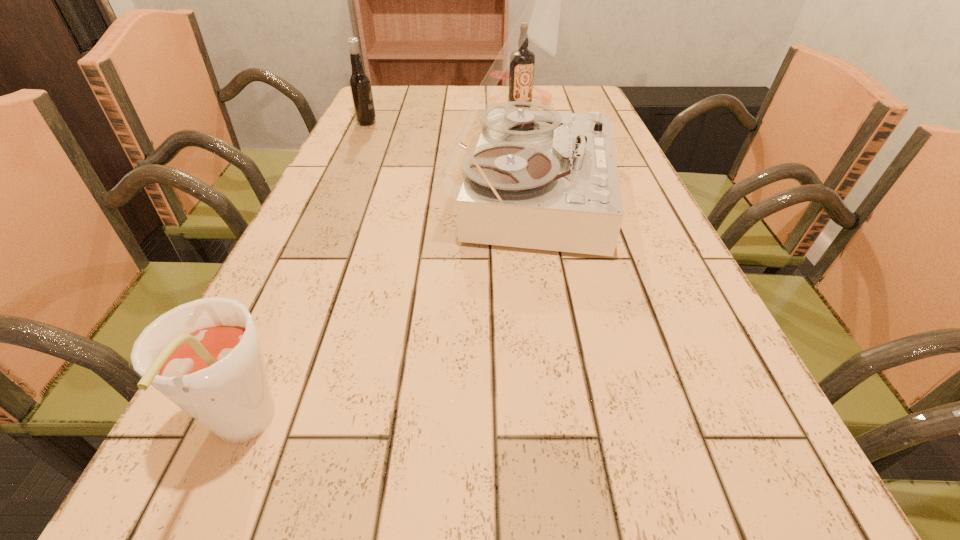
Where is `object that stands as the second closest to the second nearest root beer`? The width and height of the screenshot is (960, 540). object that stands as the second closest to the second nearest root beer is located at coordinates (521, 74).

Locate an element on the screen. This screenshot has width=960, height=540. object that stands as the closest to the second farthest root beer is located at coordinates point(543,180).

Identify which root beer is the second closest to the nearest root beer. Please provide its 2D coordinates. Your answer should be formatted as a tuple, i.e. [(x, y)], where the tuple contains the x and y coordinates of a point satisfying the conditions above.

[(521, 74)]

Locate which root beer is the closest to the nearest object. Please provide its 2D coordinates. Your answer should be formatted as a tuple, i.e. [(x, y)], where the tuple contains the x and y coordinates of a point satisfying the conditions above.

[(360, 86)]

The height and width of the screenshot is (540, 960). What are the coordinates of `free space that satisfies the following two spatial constraints: 1. on the back side of the third farthest object; 2. on the label of the second nearest root beer` in the screenshot? It's located at (519, 123).

What are the coordinates of `blank area in the image that satisfies the following two spatial constraints: 1. on the label of the second farthest root beer; 2. on the left side of the tallest object` in the screenshot? It's located at (334, 193).

What are the coordinates of `free region that satisfies the following two spatial constraints: 1. on the label of the second nearest root beer; 2. on the right side of the record player` in the screenshot? It's located at (334, 193).

At what (x,y) coordinates should I click in order to perform the action: click on free point that satisfies the following two spatial constraints: 1. on the label of the farthest root beer; 2. on the label of the second farthest object. Please return your answer as a coordinate pair (x, y). The image size is (960, 540). Looking at the image, I should click on (523, 123).

Image resolution: width=960 pixels, height=540 pixels. Find the location of `vacant space that satisfies the following two spatial constraints: 1. on the label of the third nearest object; 2. on the back side of the tallest object`. vacant space that satisfies the following two spatial constraints: 1. on the label of the third nearest object; 2. on the back side of the tallest object is located at coordinates (334, 193).

Identify the location of vacant area in the image that satisfies the following two spatial constraints: 1. on the label of the second farthest object; 2. on the right side of the record player. (334, 193).